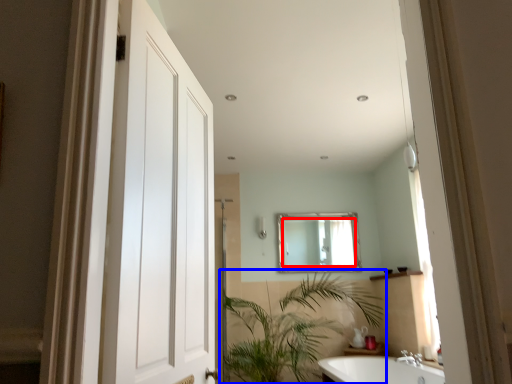
Question: Which object appears farthest to the camera in this image, mirror (highlighted by a red box) or houseplant (highlighted by a blue box)?

Choices:
 (A) mirror
 (B) houseplant

Answer: (A)